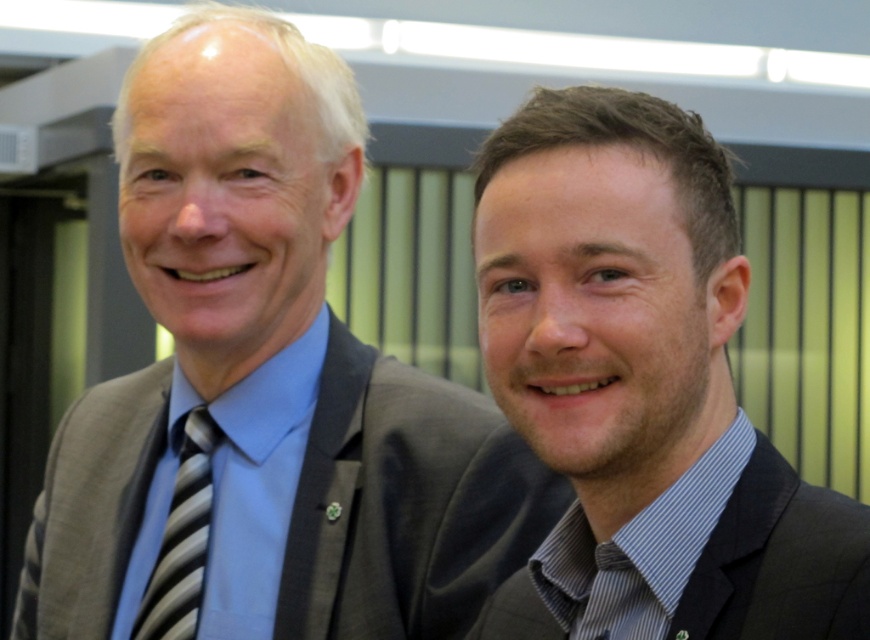
Question: Which object is positioned farthest from the black textured suit at right?

Choices:
 (A) striped fabric tie at left
 (B) gray suit at left

Answer: (A)

Question: Which point is closer to the camera taking this photo?

Choices:
 (A) (91, 403)
 (B) (760, 616)

Answer: (B)

Question: Is gray suit at left bigger than black textured suit at right?

Choices:
 (A) no
 (B) yes

Answer: (B)

Question: In this image, where is dark brown suit at right located relative to black textured suit at right?

Choices:
 (A) right
 (B) left

Answer: (B)

Question: Which point is closer to the camera?

Choices:
 (A) striped fabric tie at left
 (B) black textured suit at right
 (C) dark brown suit at right

Answer: (B)

Question: Does dark brown suit at right appear under striped fabric tie at left?

Choices:
 (A) yes
 (B) no

Answer: (B)